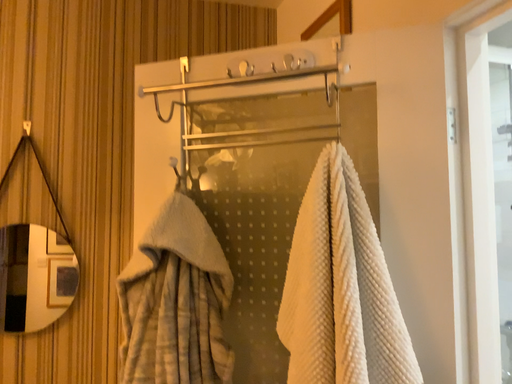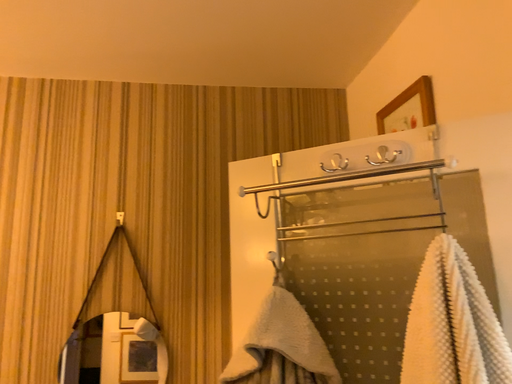
Question: Which way did the camera rotate in the video?

Choices:
 (A) rotated left
 (B) rotated right

Answer: (A)